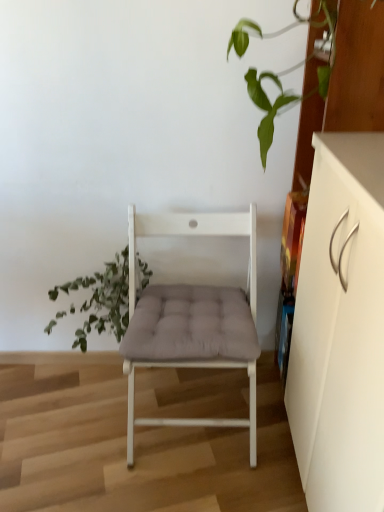
Question: Does green leafy plant at left have a greater width compared to white matte chair at center?

Choices:
 (A) no
 (B) yes

Answer: (A)

Question: Can you confirm if green leafy plant at left is bigger than white matte chair at center?

Choices:
 (A) yes
 (B) no

Answer: (B)

Question: Is white matte chair at center surrounded by green leafy plant at left?

Choices:
 (A) yes
 (B) no

Answer: (B)

Question: From a real-world perspective, is green leafy plant at left on white matte chair at center?

Choices:
 (A) no
 (B) yes

Answer: (A)

Question: Can you confirm if green leafy plant at left is smaller than white matte chair at center?

Choices:
 (A) no
 (B) yes

Answer: (B)

Question: Is green leafy plant at left not inside white matte chair at center?

Choices:
 (A) yes
 (B) no

Answer: (A)

Question: Considering the relative positions of white matte cabinet at right and white matte chair at center in the image provided, is white matte cabinet at right to the right of white matte chair at center from the viewer's perspective?

Choices:
 (A) no
 (B) yes

Answer: (B)

Question: From the image's perspective, would you say white matte cabinet at right is positioned over white matte chair at center?

Choices:
 (A) yes
 (B) no

Answer: (B)

Question: Is white matte cabinet at right in front of white matte chair at center?

Choices:
 (A) yes
 (B) no

Answer: (A)

Question: Is the surface of white matte cabinet at right in direct contact with white matte chair at center?

Choices:
 (A) yes
 (B) no

Answer: (B)

Question: Considering the relative sizes of white matte cabinet at right and white matte chair at center in the image provided, is white matte cabinet at right shorter than white matte chair at center?

Choices:
 (A) yes
 (B) no

Answer: (B)

Question: From a real-world perspective, is white matte cabinet at right over white matte chair at center?

Choices:
 (A) yes
 (B) no

Answer: (A)

Question: Considering the relative sizes of green leafy plant at left and white matte cabinet at right in the image provided, is green leafy plant at left thinner than white matte cabinet at right?

Choices:
 (A) yes
 (B) no

Answer: (A)